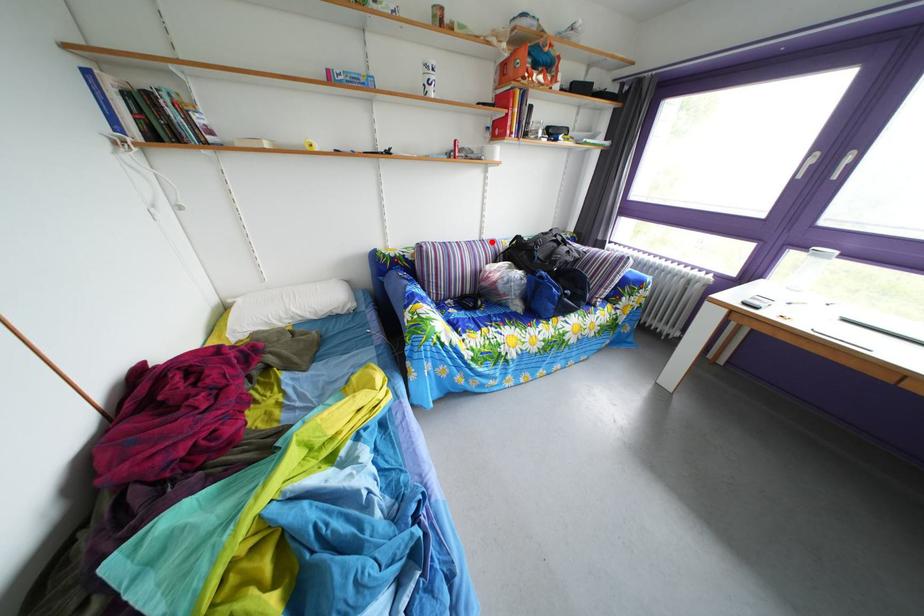
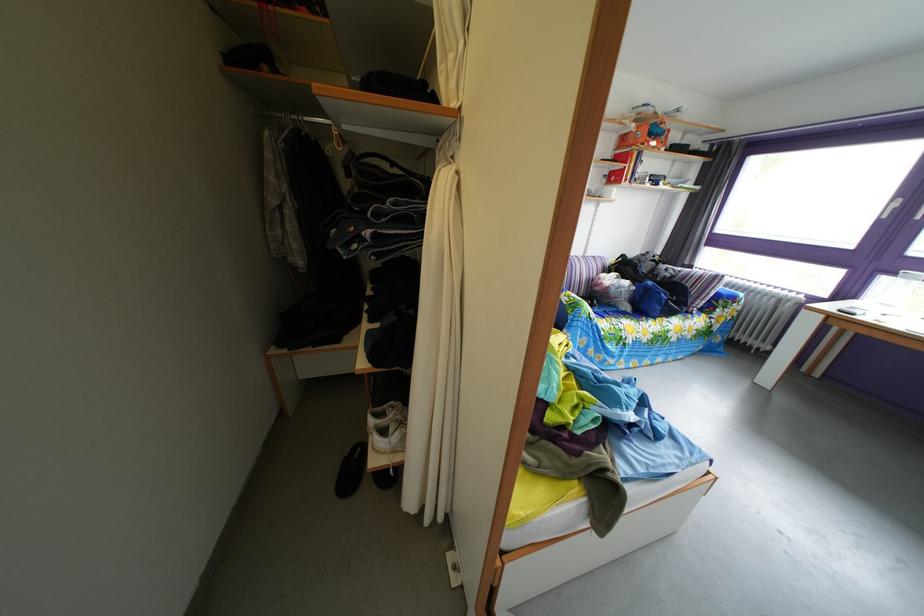
Find the pixel in the second image that matches the highlighted location in the first image.

(596, 261)